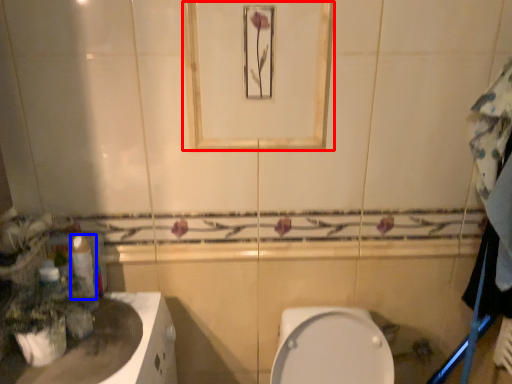
Question: Which object appears farthest to the camera in this image, mirror (highlighted by a red box) or toilet paper (highlighted by a blue box)?

Choices:
 (A) mirror
 (B) toilet paper

Answer: (B)